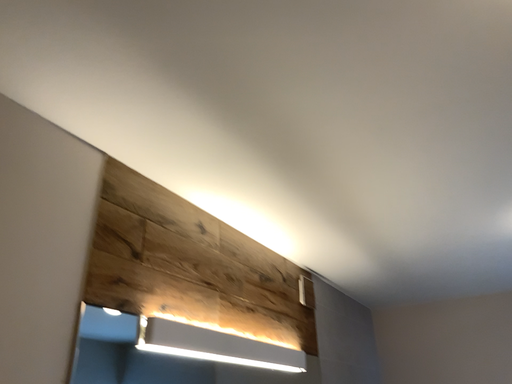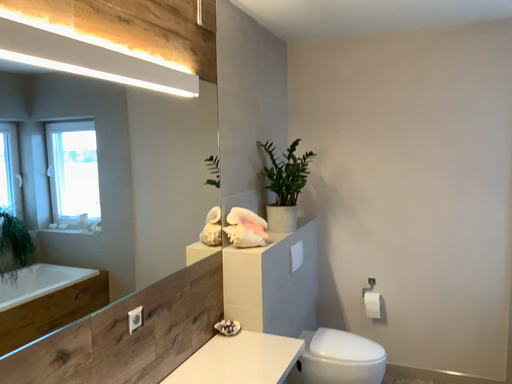
Question: How did the camera likely rotate when shooting the video?

Choices:
 (A) rotated downward
 (B) rotated upward

Answer: (A)